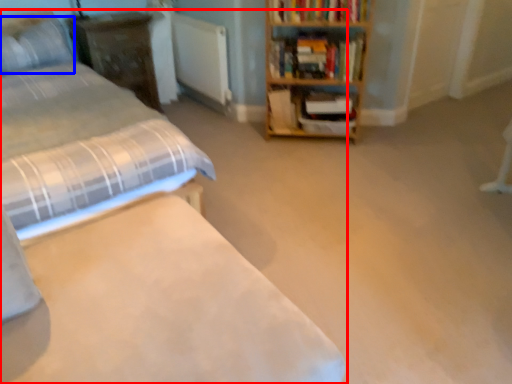
Question: Which object appears closest to the camera in this image, bed (highlighted by a red box) or pillow (highlighted by a blue box)?

Choices:
 (A) bed
 (B) pillow

Answer: (A)